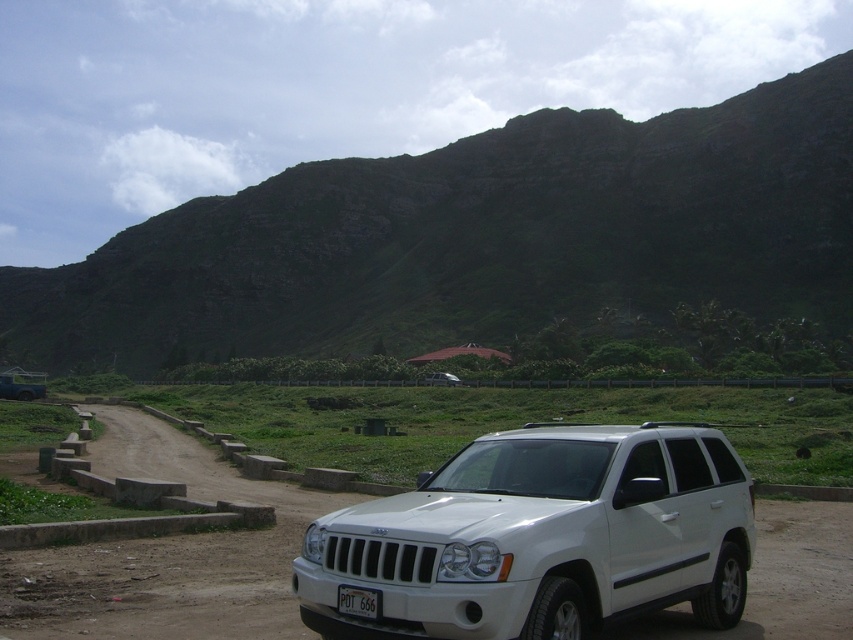
This screenshot has width=853, height=640. What do you see at coordinates (479, 237) in the screenshot? I see `green rocky mountain at upper center` at bounding box center [479, 237].

Does green rocky mountain at upper center appear on the left side of white plastic license plate at center?

Yes, green rocky mountain at upper center is to the left of white plastic license plate at center.

Where is `green rocky mountain at upper center`? Image resolution: width=853 pixels, height=640 pixels. green rocky mountain at upper center is located at coordinates pos(479,237).

Where is `green rocky mountain at upper center`? This screenshot has width=853, height=640. green rocky mountain at upper center is located at coordinates (479, 237).

Does white plastic license plate at center come in front of white matte jeep at lower center?

Yes, white plastic license plate at center is in front of white matte jeep at lower center.

Is point (380, 616) behind point (32, 396)?

No.

The width and height of the screenshot is (853, 640). What are the coordinates of `white plastic license plate at center` in the screenshot? It's located at (358, 602).

In order to click on white plastic license plate at center in this screenshot , I will do (358, 602).

Can you confirm if green rocky mountain at upper center is smaller than white matte suv at center?

No.

Does green rocky mountain at upper center appear on the left side of white matte suv at center?

Indeed, green rocky mountain at upper center is positioned on the left side of white matte suv at center.

What are the coordinates of `green rocky mountain at upper center` in the screenshot? It's located at (479, 237).

At what (x,y) coordinates should I click in order to perform the action: click on green rocky mountain at upper center. Please return your answer as a coordinate pair (x, y). Looking at the image, I should click on 479,237.